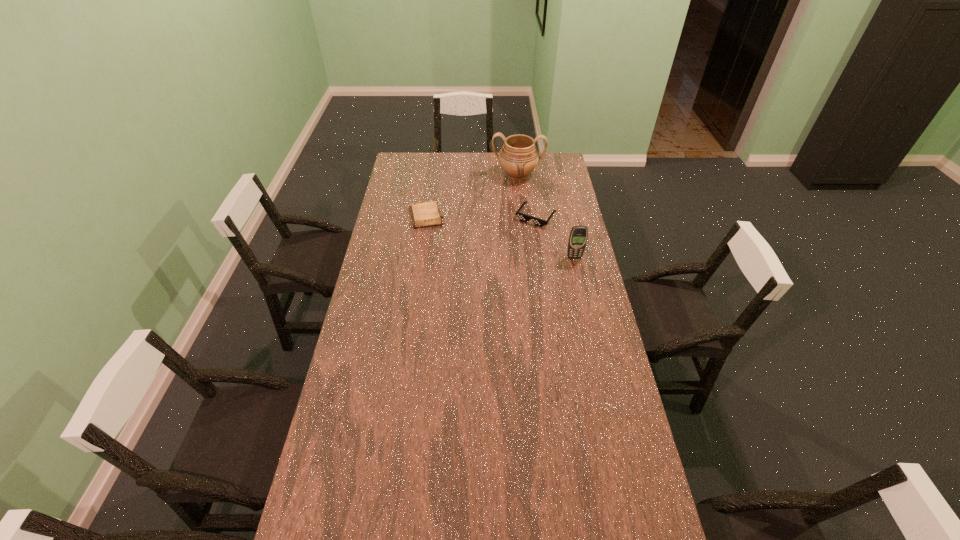
I want to click on free space located 0.380m on the front-facing side of the urn, so click(512, 232).

Where is `vacant space located on the front-facing side of the urn`? vacant space located on the front-facing side of the urn is located at coordinates (514, 207).

Locate an element on the screen. Image resolution: width=960 pixels, height=540 pixels. blank area located on the front-facing side of the sunglasses is located at coordinates (523, 233).

Identify the location of free spot located on the front-facing side of the sunglasses. The image size is (960, 540). (510, 252).

Where is `free space located 0.080m on the front-facing side of the sunglasses`? free space located 0.080m on the front-facing side of the sunglasses is located at coordinates (520, 237).

This screenshot has height=540, width=960. Identify the location of object at the far edge. (518, 157).

Identify the location of object that is positioned at the left edge. (424, 214).

Where is `cellular telephone at the right edge`? This screenshot has height=540, width=960. cellular telephone at the right edge is located at coordinates (578, 236).

Where is `urn at the right edge`? This screenshot has height=540, width=960. urn at the right edge is located at coordinates (518, 157).

This screenshot has height=540, width=960. Find the location of `sunglasses at the right edge`. sunglasses at the right edge is located at coordinates (523, 217).